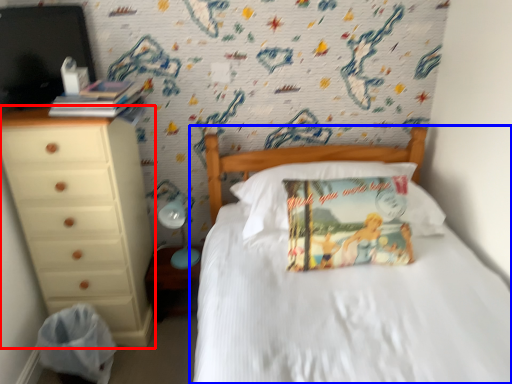
Question: Which object appears farthest to the camera in this image, chest of drawers (highlighted by a red box) or bed (highlighted by a blue box)?

Choices:
 (A) chest of drawers
 (B) bed

Answer: (A)